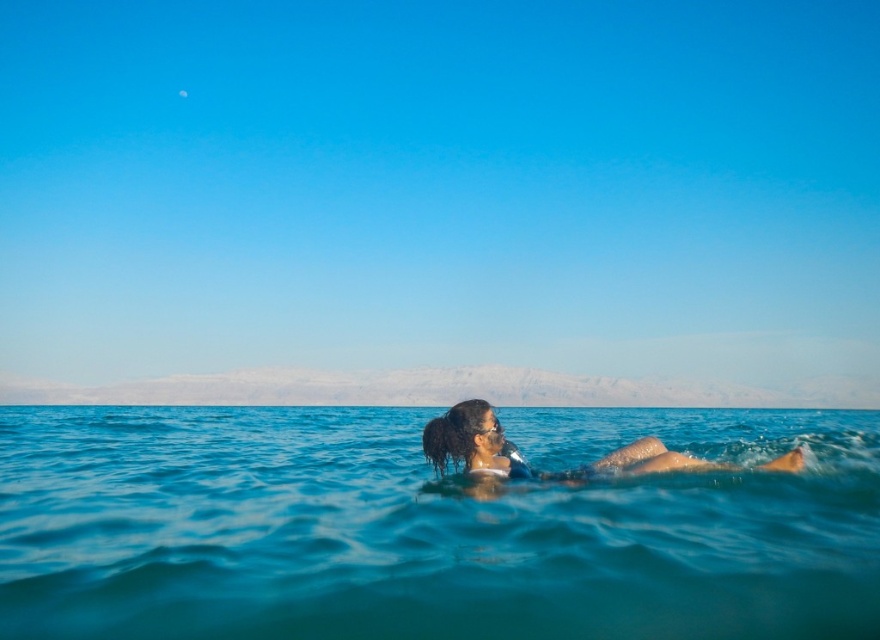
From the picture: You are standing at the edge of the Dead Sea and see two points in the water labeled as point (282, 435) and point (783, 458). Which point is closer to you?

Point (282, 435) is further to the camera than point .717, 0.891, so the point closer to you is point (783, 458).

You are a photographer trying to capture the person floating in the Dead Sea. You notice the clear blue water at center and the dark brown hair at center. Which object in the scene takes up more space in the photo?

The clear blue water at center takes up more space in the photo because it is bigger than the dark brown hair at center.

You are a swimmer who wants to know if the clear blue water at center is wider than the dark brown hair at center. Based on the scene, can you confirm this?

Yes, the clear blue water at center is wider than the dark brown hair at center according to the description.